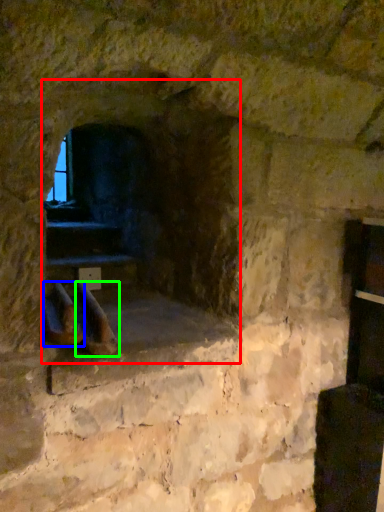
Question: Considering the real-world distances, which object is closest to fireplace (highlighted by a red box)? footwear (highlighted by a blue box) or footwear (highlighted by a green box).

Choices:
 (A) footwear
 (B) footwear

Answer: (B)